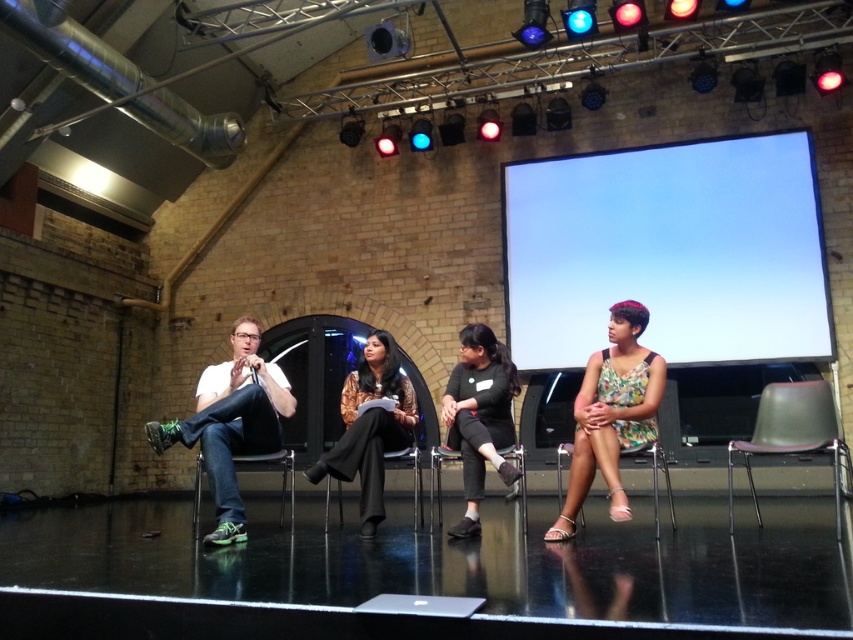
Is denim fabric chair at left smaller than black fabric chair at center?

Indeed, denim fabric chair at left has a smaller size compared to black fabric chair at center.

Between denim fabric chair at left and black fabric chair at center, which one is positioned lower?

Positioned lower is black fabric chair at center.

At what (x,y) coordinates should I click in order to perform the action: click on denim fabric chair at left. Please return your answer as a coordinate pair (x, y). Image resolution: width=853 pixels, height=640 pixels. Looking at the image, I should click on (231, 442).

What are the coordinates of `denim fabric chair at left` in the screenshot? It's located at (231, 442).

Is white matte projection screen at upper center taller than black fabric pants at center?

Indeed, white matte projection screen at upper center has a greater height compared to black fabric pants at center.

Does point (509, 301) lie in front of point (374, 508)?

No, (509, 301) is further to viewer.

Between point (525, 337) and point (366, 339), which one is positioned behind?

Point (525, 337)

Image resolution: width=853 pixels, height=640 pixels. Find the location of `white matte projection screen at upper center`. white matte projection screen at upper center is located at coordinates (669, 252).

Does point (236, 397) lie behind point (567, 444)?

No, it is not.

Can you confirm if denim fabric chair at left is positioned above metallic silver chair at center?

Yes.

I want to click on denim fabric chair at left, so click(x=231, y=442).

Locate an element on the screen. This screenshot has height=640, width=853. denim fabric chair at left is located at coordinates (231, 442).